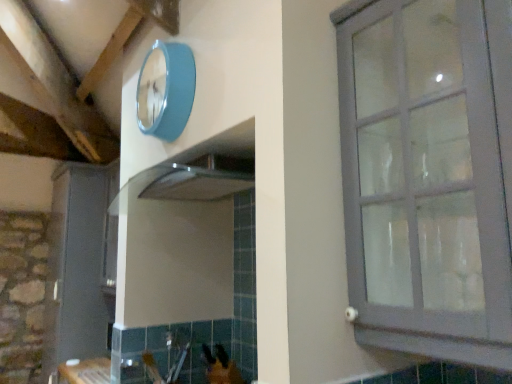
Question: Considering the relative positions of matte gray cabinet at right and matte gray cabinet at left in the image provided, is matte gray cabinet at right to the right of matte gray cabinet at left from the viewer's perspective?

Choices:
 (A) yes
 (B) no

Answer: (A)

Question: From a real-world perspective, is matte gray cabinet at right on top of matte gray cabinet at left?

Choices:
 (A) yes
 (B) no

Answer: (A)

Question: From the image's perspective, would you say matte gray cabinet at right is shown under matte gray cabinet at left?

Choices:
 (A) no
 (B) yes

Answer: (A)

Question: Is matte gray cabinet at right thinner than matte gray cabinet at left?

Choices:
 (A) no
 (B) yes

Answer: (B)

Question: Does matte gray cabinet at right come in front of matte gray cabinet at left?

Choices:
 (A) no
 (B) yes

Answer: (B)

Question: Can you confirm if matte gray cabinet at right is wider than matte gray cabinet at left?

Choices:
 (A) yes
 (B) no

Answer: (B)

Question: Is teal glossy clock at upper center not inside matte gray cabinet at left?

Choices:
 (A) no
 (B) yes

Answer: (B)

Question: Is matte gray cabinet at left surrounded by teal glossy clock at upper center?

Choices:
 (A) no
 (B) yes

Answer: (A)

Question: From the image's perspective, does teal glossy clock at upper center appear lower than matte gray cabinet at left?

Choices:
 (A) yes
 (B) no

Answer: (B)

Question: Does teal glossy clock at upper center have a greater height compared to matte gray cabinet at left?

Choices:
 (A) no
 (B) yes

Answer: (A)

Question: Is the surface of teal glossy clock at upper center in direct contact with matte gray cabinet at left?

Choices:
 (A) yes
 (B) no

Answer: (B)

Question: Is teal glossy clock at upper center positioned in front of matte gray cabinet at left?

Choices:
 (A) yes
 (B) no

Answer: (A)

Question: Can you confirm if teal glossy clock at upper center is smaller than matte gray cabinet at right?

Choices:
 (A) no
 (B) yes

Answer: (B)